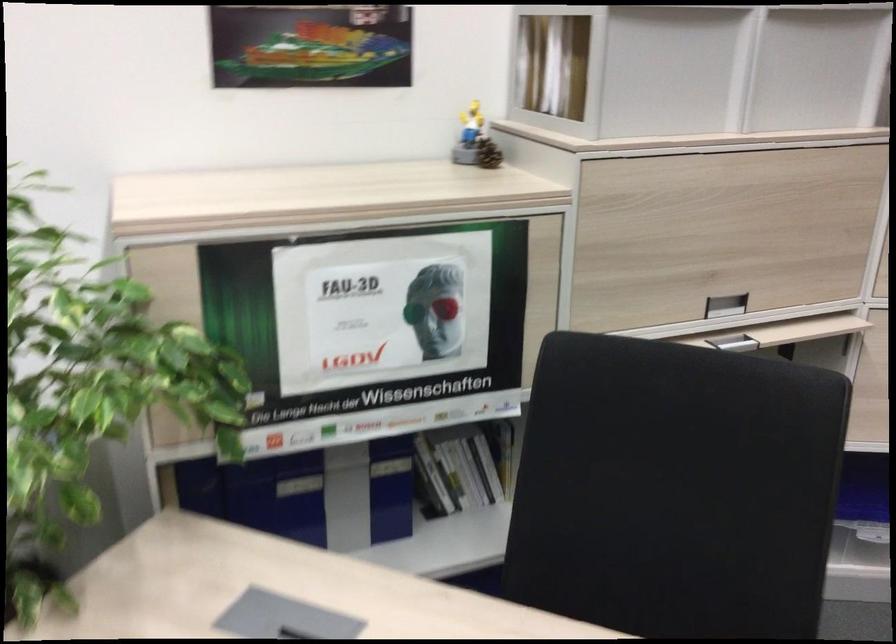
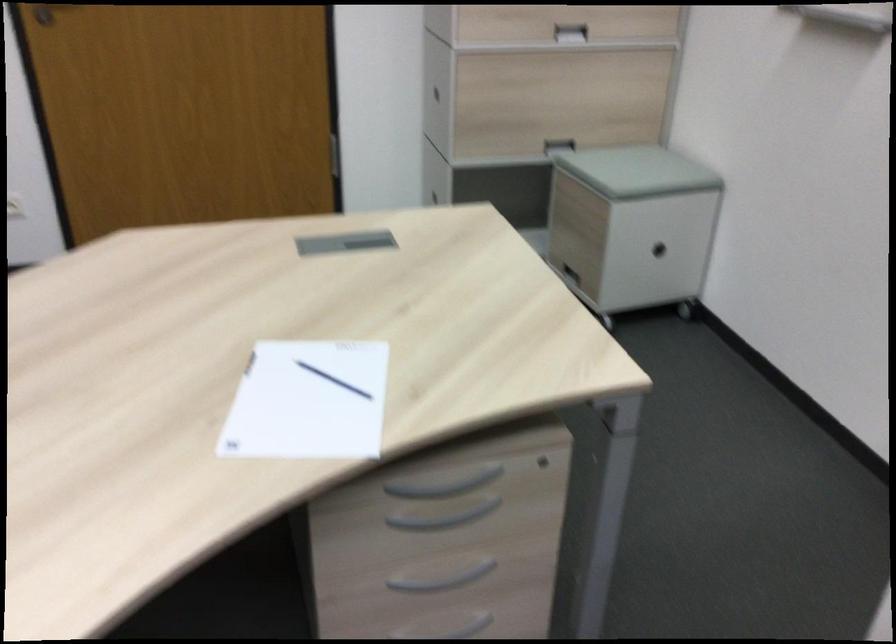
The first image is from the beginning of the video and the second image is from the end. How did the camera likely rotate when shooting the video?

The camera rotated toward right-down.